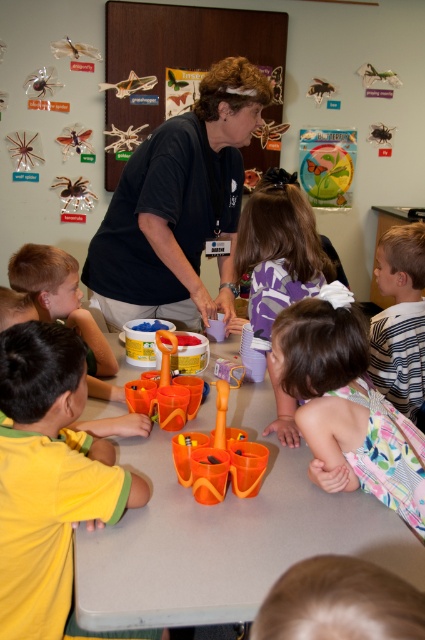
Question: Based on their relative distances, which object is farther from the yellow matte shirt at lower left?

Choices:
 (A) striped fabric shirt at right
 (B) blonde hair at lower center
 (C) plaid fabric dress at lower center
 (D) metallic silver insects at upper center

Answer: (D)

Question: Can you confirm if plaid fabric dress at lower center is positioned above metallic silver insects at upper center?

Choices:
 (A) yes
 (B) no

Answer: (B)

Question: Which of the following is the farthest from the observer?

Choices:
 (A) (125, 317)
 (B) (340, 506)

Answer: (A)

Question: Which of the following is the farthest from the observer?

Choices:
 (A) (147, 371)
 (B) (170, 19)

Answer: (B)

Question: Is striped fabric shirt at right above translucent plastic toy at center?

Choices:
 (A) no
 (B) yes

Answer: (B)

Question: Does orange plastic table at center have a larger size compared to plaid fabric dress at lower center?

Choices:
 (A) no
 (B) yes

Answer: (B)